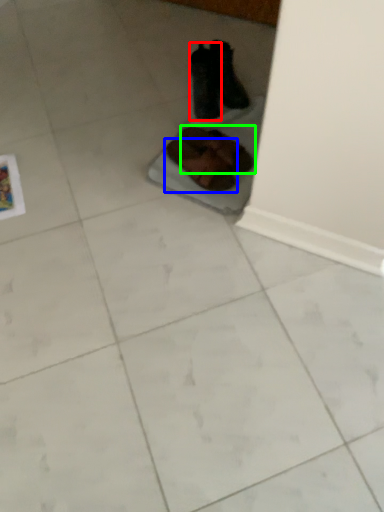
Question: Based on their relative distances, which object is farther from footwear (highlighted by a red box)? Choose from footwear (highlighted by a blue box) and footwear (highlighted by a green box).

Choices:
 (A) footwear
 (B) footwear

Answer: (A)